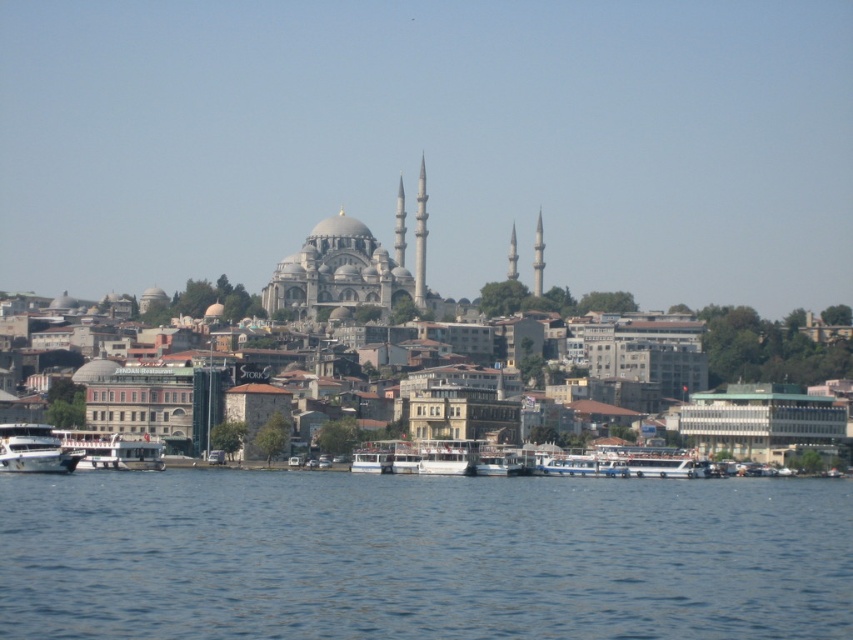
You are a tour guide leading a group to the mosque. You have to cross the blue water at lower center to reach the mosque. The white matte boat at lower center is the only available boat. Can the boat fit in the water to carry your group?

The blue water at lower center might be wider than white matte boat at lower center, so the boat can fit in the water to carry the group.

You are standing at the point marked as point (421, 556) in the cityscape image. What is directly beneath your feet?

The blue water at lower center is located at point (421, 556), so the area directly beneath your feet is blue water at lower center.

You are standing at the center of the city and want to reach the blue water at lower center. According to the coordinates provided, in which direction should you move to get there?

The blue water at lower center is located at coordinates point (x=421, y=556). Since the coordinate system is not specified, but typically in such contexts, the first value might represent the horizontal axis and the second the vertical. Assuming the origin is at the bottom left corner, moving towards higher x values would mean moving to the right. Therefore, to reach the blue water at lower center, you should move to the right from the center.